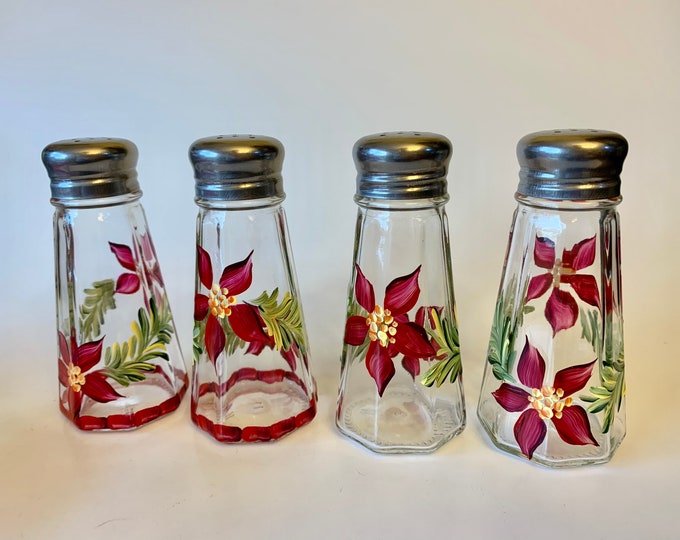
Where is `salt shaker 3`? Image resolution: width=680 pixels, height=540 pixels. salt shaker 3 is located at coordinates [x=389, y=318].